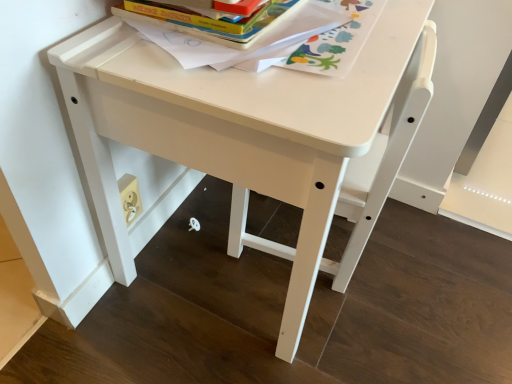
This screenshot has height=384, width=512. What are the coordinates of `vacant area located to the right-hand side of hardcover book at upper center` in the screenshot? It's located at (368, 41).